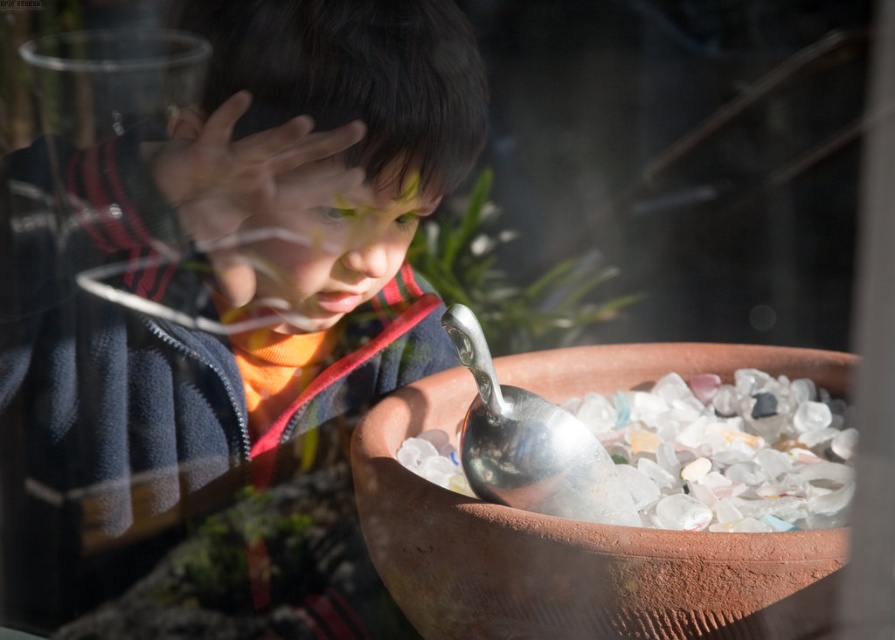
You are designing a storage box that needs to accommodate both the matte black jacket at upper left and the terracotta clay bowl at center. Based on their widths, which object requires a wider storage space?

The terracotta clay bowl at center requires a wider storage space because its width is greater than the matte black jacket at upper left.

You are a photographer trying to capture both the matte black jacket at upper left and the silver metallic spoon at lower center in a single frame. Based on their positions, which object should you focus on first to ensure both are in focus?

The matte black jacket at upper left is much taller than the silver metallic spoon at lower center. To ensure both are in focus, you should focus on the matte black jacket at upper left first since it is larger and occupies more of the frame.

The child is holding a spoon and a bowl. Based on the scene, which object is positioned lower, the terracotta clay bowl at center or the smooth skin hand at center?

The terracotta clay bowl at center is located below smooth skin hand at center, so the bowl is positioned lower than the hand.